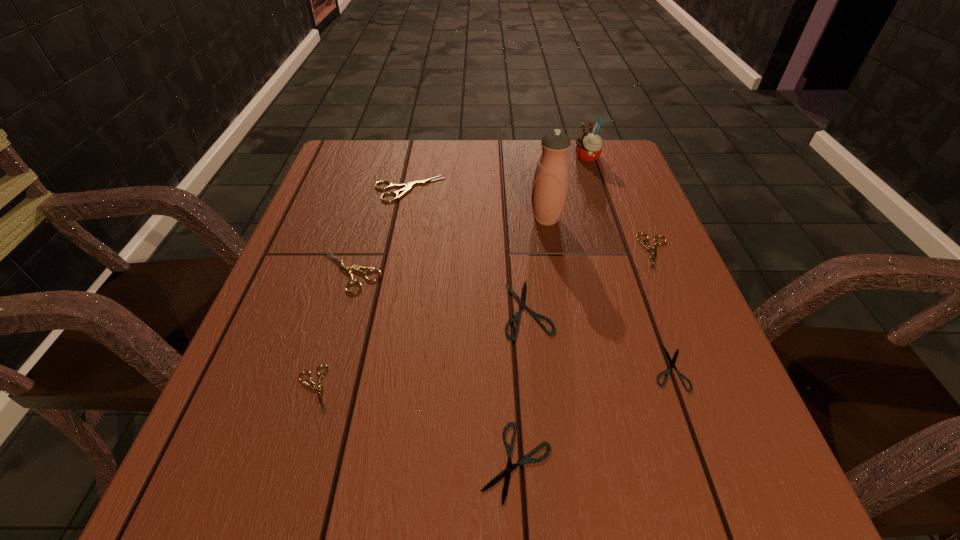
The width and height of the screenshot is (960, 540). I want to click on the third farthest object, so click(550, 185).

In order to click on thermos bottle in this screenshot , I will do `click(550, 185)`.

Where is `muffin`? muffin is located at coordinates (x=589, y=145).

Locate an element on the screen. The height and width of the screenshot is (540, 960). pink muffin is located at coordinates 589,145.

Identify the location of the third tallest object. (407, 187).

In order to click on the second farthest object in this screenshot , I will do `click(407, 187)`.

Image resolution: width=960 pixels, height=540 pixels. I want to click on the third smallest beige shears, so click(346, 269).

Where is `the sixth shortest shears`? the sixth shortest shears is located at coordinates (346, 269).

Locate an element on the screen. the rightmost object is located at coordinates (653, 250).

You are a GUI agent. You are given a task and a screenshot of the screen. Output one action in this format:
    pyautogui.click(x=<x>, y=<y>)
    Task: Click on the rightmost shears
    The height and width of the screenshot is (540, 960).
    Given the screenshot: What is the action you would take?
    pyautogui.click(x=653, y=250)